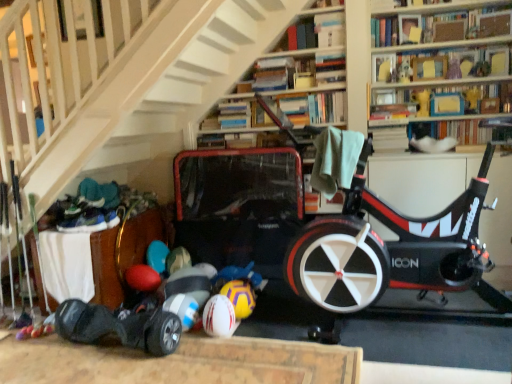
Locate an element on the screen. vacant area that is in front of yellowtexturebeach ball at lower center is located at coordinates (243, 335).